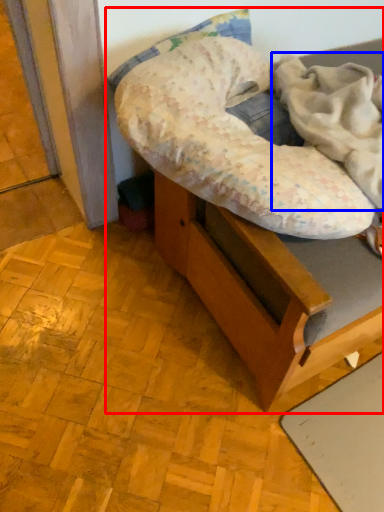
Question: Which point is closer to the camera, furniture (highlighted by a red box) or blanket (highlighted by a blue box)?

Choices:
 (A) furniture
 (B) blanket

Answer: (B)